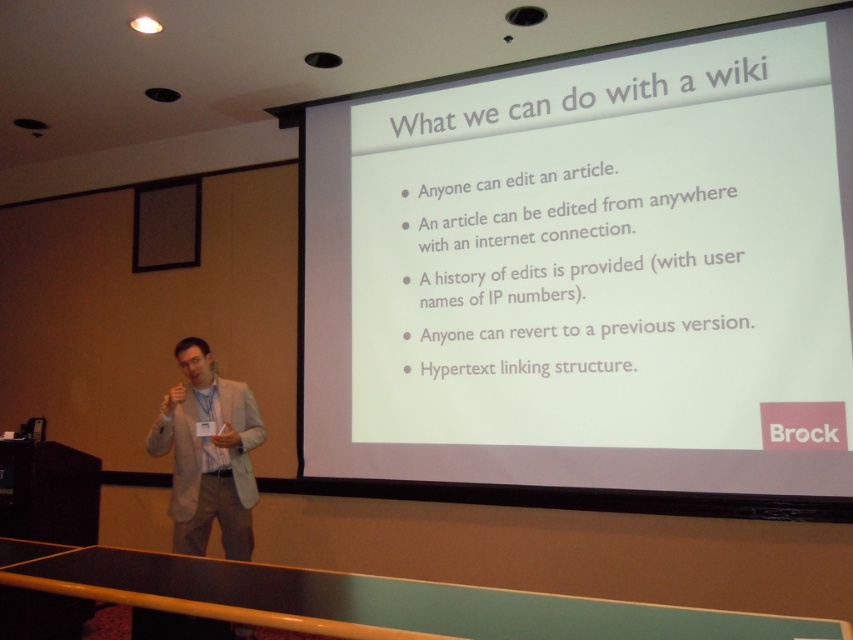
You are sitting in the audience of the presentation and want to reach the point at coordinates point (497,282). The screen is 10 feet away from you. Can you walk straight to it?

The point (497,282) is 12.61 feet from the viewer, which is farther than the screen distance of 10 feet. Therefore, you cannot walk straight to it as it is beyond the screen.

You are an attendee at the presentation and want to take a photo of the white matte projector screen at upper center and the light gray suit at center. Which object should you focus on first if you want to capture both in one shot without moving the camera?

The white matte projector screen at upper center is bigger than the light gray suit at center, so you should focus on the white matte projector screen at upper center first to ensure it fills the frame appropriately before adjusting for the smaller light gray suit at center.

You are an event organizer who needs to ensure that the presenter can comfortably reach the remote control to advance slides during their talk. The remote control has a maximum range of 3.5 feet. Based on the scene, can the presenter using the light gray suit at center reach the remote control if it is placed near the white matte projector screen at upper center?

The white matte projector screen at upper center and light gray suit at center are 4.09 feet apart. Since the remote control has a maximum range of 3.5 feet, the presenter using the light gray suit at center would be unable to reach the remote control placed near the white matte projector screen at upper center as the distance exceeds the remote control range.